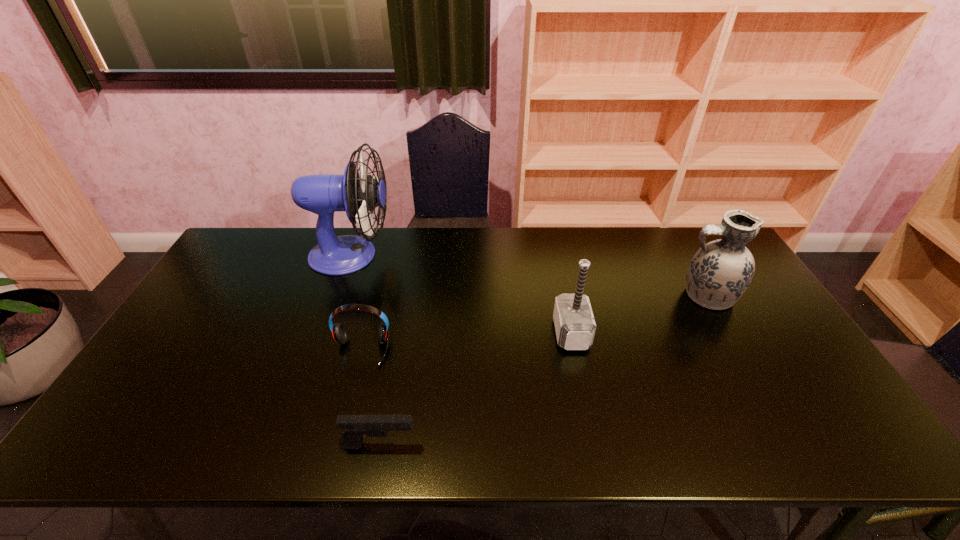
In the image, there is a desktop. Where is `vacant space at the left edge`? This screenshot has width=960, height=540. vacant space at the left edge is located at coordinates (203, 315).

At what (x,y) coordinates should I click in order to perform the action: click on vacant space at the right edge of the desktop. Please return your answer as a coordinate pair (x, y). The width and height of the screenshot is (960, 540). Looking at the image, I should click on (822, 392).

I want to click on vacant region at the far right corner of the desktop, so click(698, 228).

Find the location of a particular element. vacant space at the near right corner is located at coordinates (802, 450).

The height and width of the screenshot is (540, 960). I want to click on empty space that is in between the fourth tallest object and the nearest object, so click(x=370, y=398).

The width and height of the screenshot is (960, 540). I want to click on blank region between the headset and the hammer, so click(467, 342).

Find the location of a particular element. The height and width of the screenshot is (540, 960). vacant region between the vase and the headset is located at coordinates (534, 323).

The image size is (960, 540). Identify the location of vacant region between the second object from right to left and the nearest object. point(475,389).

I want to click on empty space between the second object from right to left and the second shortest object, so click(467, 342).

Locate an element on the screen. The height and width of the screenshot is (540, 960). vacant space that's between the vase and the shortest object is located at coordinates (542, 370).